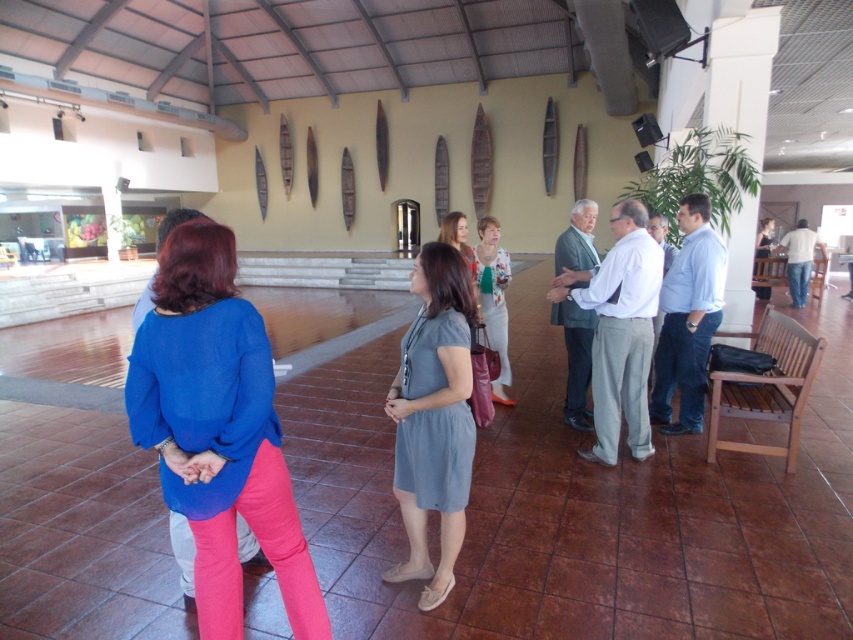
You are a photographer setting up for an event in the lobby. You need to position a light source between the gray cotton dress at center and the floral print blouse at center. What is the minimum distance the light should be placed from each clothing item to ensure even lighting?

The gray cotton dress at center and floral print blouse at center are 5.33 feet apart. To ensure even lighting, the light source should be placed exactly halfway between them, which would be 2.665 feet from each clothing item.

You are a fashion designer observing two blouses displayed in a lobby with high ceilings and wooden canoes on the walls. The blouses are the blue cotton blouse at center and the floral print blouse at center. Which blouse appears shorter in height?

The blue cotton blouse at center is not as tall as the floral print blouse at center, so the blue cotton blouse at center appears shorter in height.

You are a fashion designer observing the scene. You need to determine if the two garments can be displayed side by side on a mannequin stand that is 1 meter wide. Can the blue cotton blouse at center and the gray cotton dress at center fit together on the stand?

The distance between the blue cotton blouse at center and the gray cotton dress at center is 72.96 centimeters. Since the mannequin stand is 1 meter wide, which is 100 centimeters, there is enough space to fit both garments side by side as 72.96 cm is less than 100 cm.